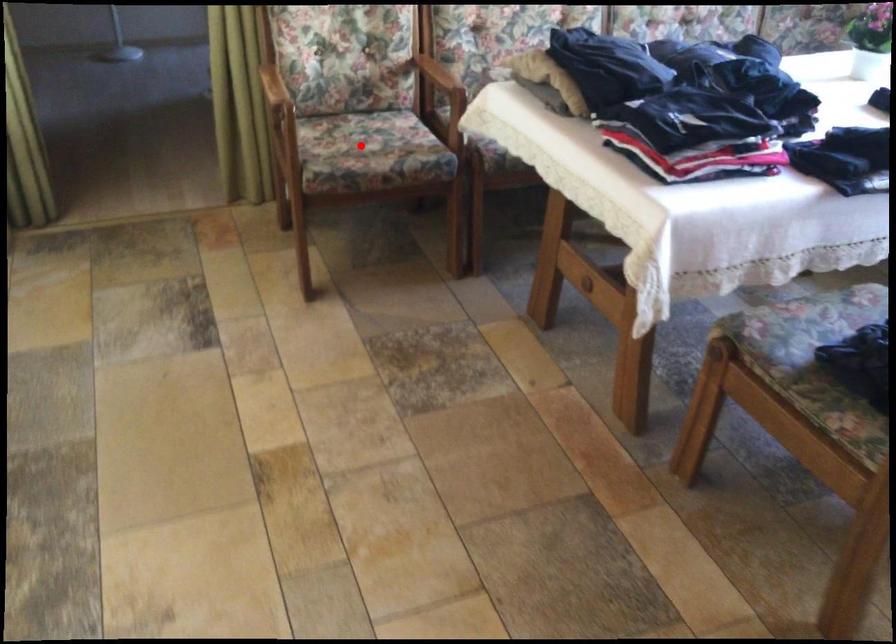
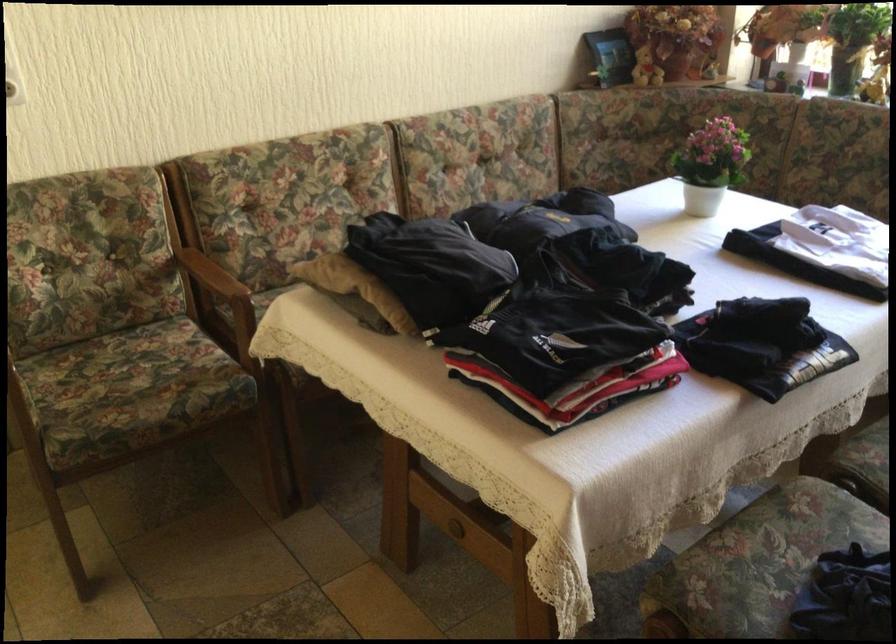
Question: I am providing you with two images of the same scene from different viewpoints. Image1 has a red point marked. In image2, the corresponding 3D location appears at what relative position? Reply with the corresponding letter.

Choices:
 (A) Closer
 (B) Farther

Answer: (A)